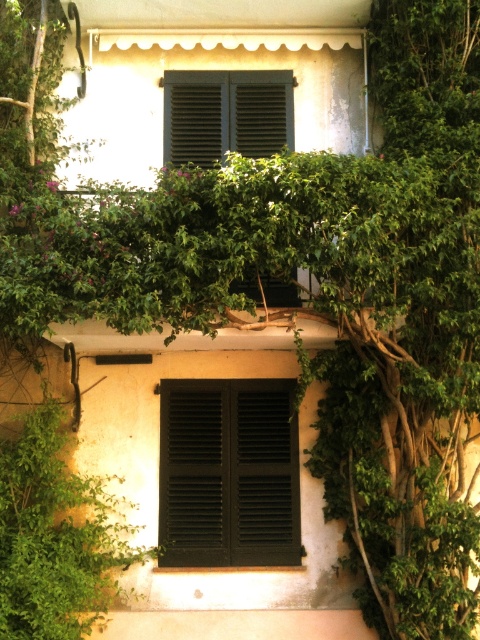
Question: Where is matte black shutters at center located in relation to matte black shutters at upper center in the image?

Choices:
 (A) below
 (B) above

Answer: (A)

Question: Is the position of matte black shutters at center more distant than that of matte black shutters at upper center?

Choices:
 (A) no
 (B) yes

Answer: (A)

Question: Where is matte black shutters at center located in relation to matte black shutters at upper center in the image?

Choices:
 (A) above
 (B) below

Answer: (B)

Question: Which point is farther to the camera?

Choices:
 (A) (173, 81)
 (B) (247, 420)

Answer: (A)